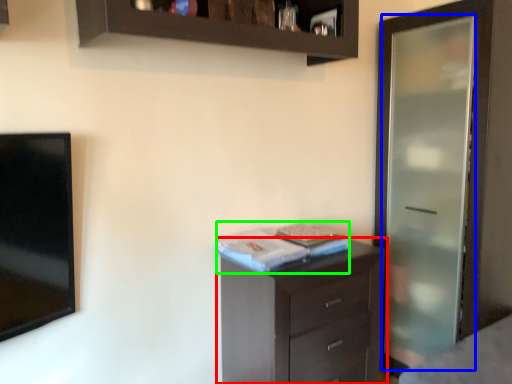
Question: Estimate the real-world distances between objects in this image. Which object is closer to chest of drawers (highlighted by a red box), screen door (highlighted by a blue box) or book (highlighted by a green box)?

Choices:
 (A) screen door
 (B) book

Answer: (B)